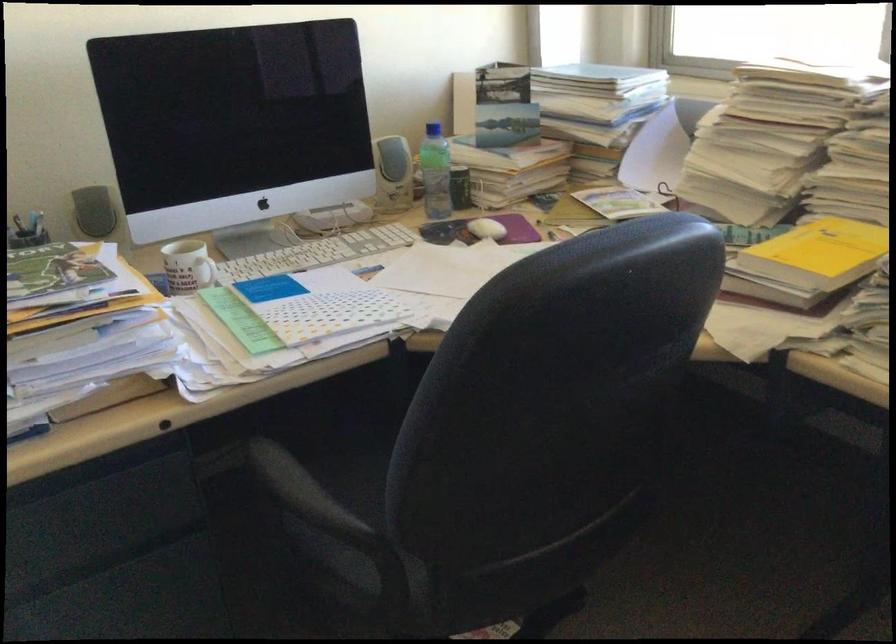
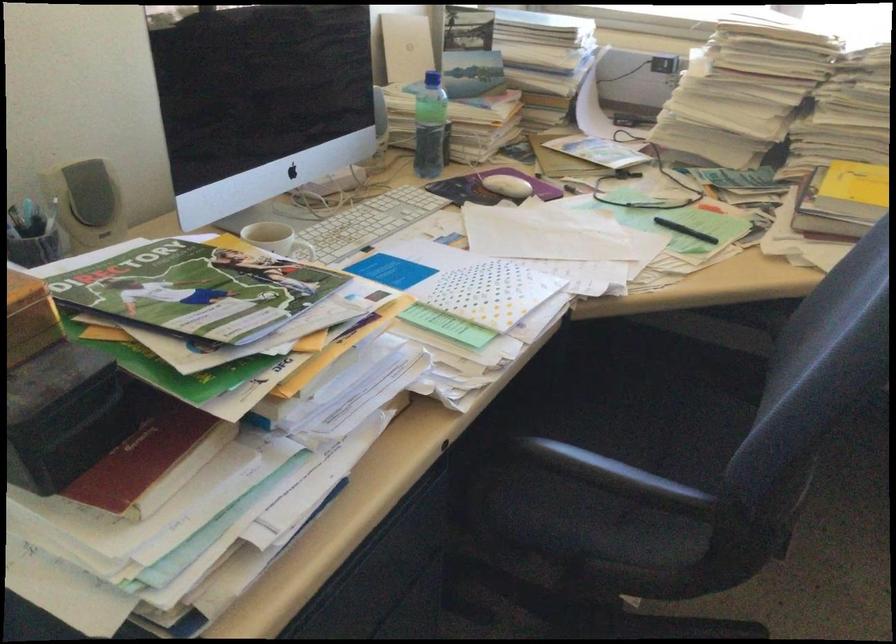
Find the pixel in the second image that matches the point at 421,169 in the first image.

(428, 126)